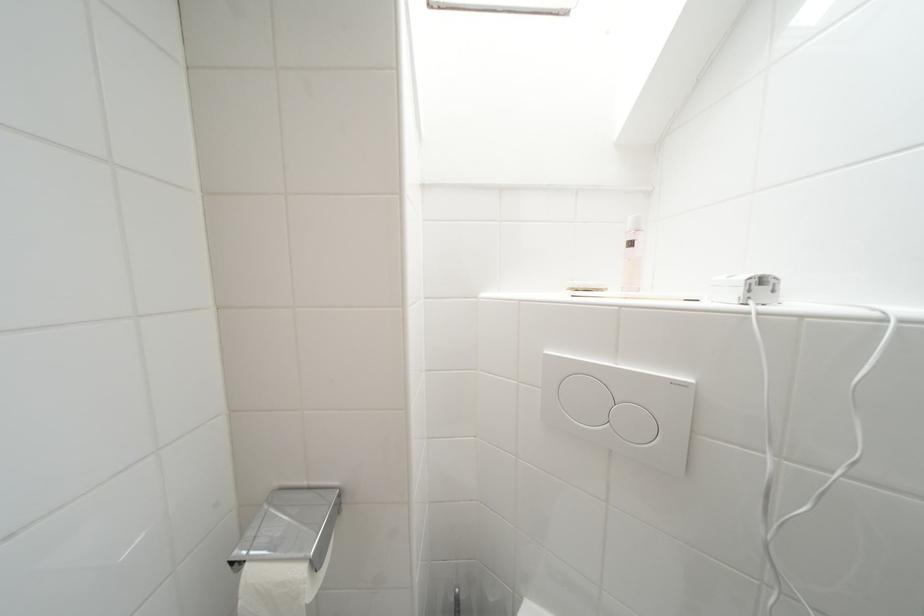
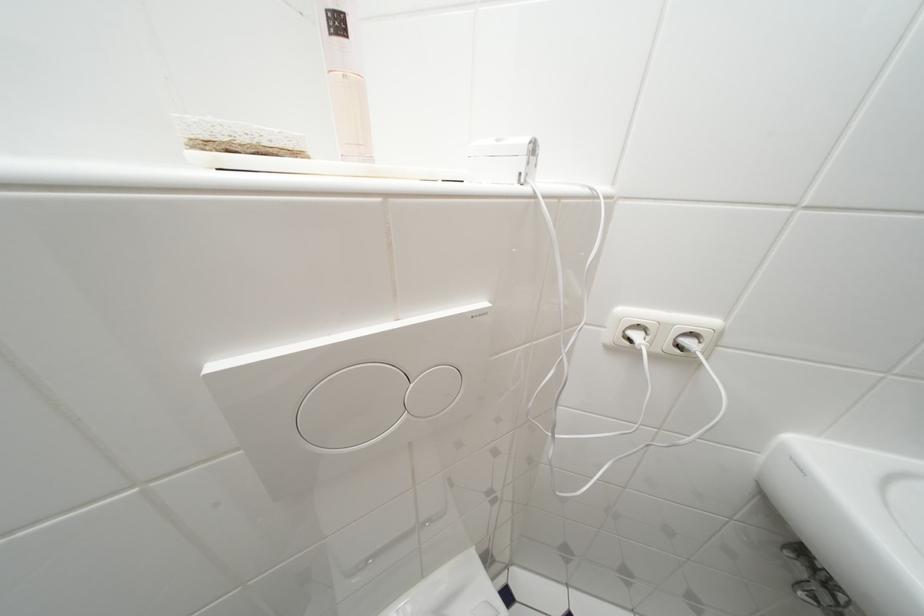
In the second image, find the point that corresponds to the point at 756,294 in the first image.

(535, 166)